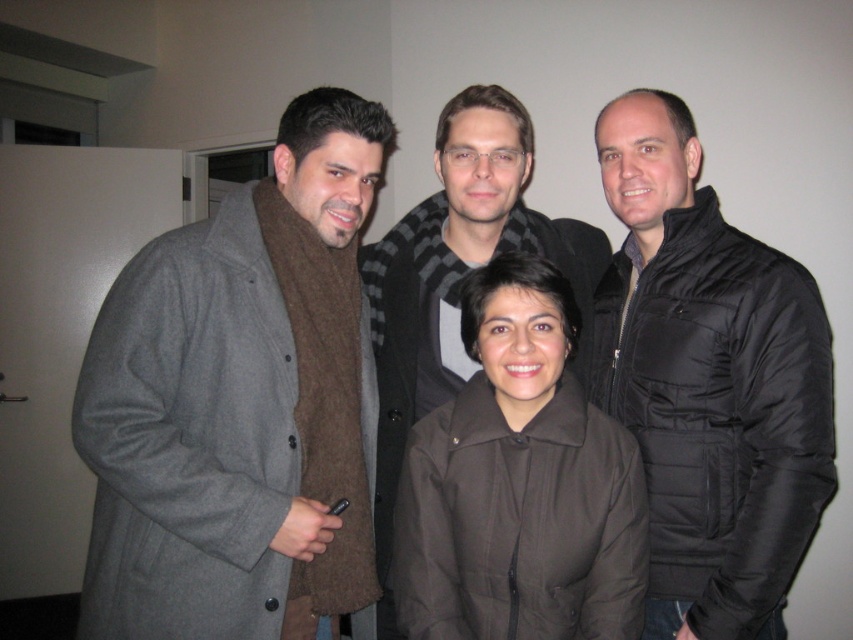
Does point (341, 433) lie behind point (547, 625)?

That is True.

Does gray wool coat at left appear over brown matte jacket at center?

Yes.

Does point (74, 394) come farther from viewer compared to point (566, 410)?

No, (74, 394) is closer to viewer.

Locate an element on the screen. The width and height of the screenshot is (853, 640). gray wool coat at left is located at coordinates (239, 403).

Measure the distance between black quilted jacket at right and camera.

black quilted jacket at right is 1.39 meters from camera.

Is black quilted jacket at right shorter than brown matte jacket at center?

Incorrect, black quilted jacket at right's height does not fall short of brown matte jacket at center's.

This screenshot has height=640, width=853. I want to click on black quilted jacket at right, so click(x=709, y=381).

Is gray wool coat at left positioned before black quilted jacket at right?

That is True.

Does gray wool coat at left appear over black quilted jacket at right?

Actually, gray wool coat at left is below black quilted jacket at right.

Image resolution: width=853 pixels, height=640 pixels. Identify the location of gray wool coat at left. (239, 403).